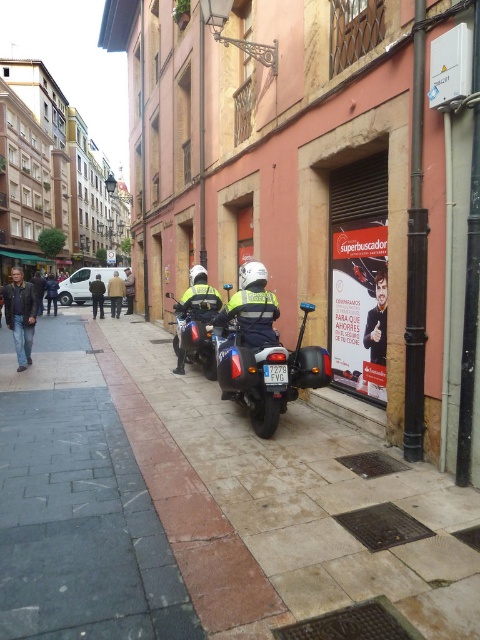
Question: Based on their relative distances, which object is farther from the shiny black motorcycle at center?

Choices:
 (A) metallic silver motorcycle at center
 (B) paved stone sidewalk at center
 (C) smooth black suit at center

Answer: (C)

Question: Which point appears closest to the camera in this image?

Choices:
 (A) tap(229, 301)
 (B) tap(375, 285)
 (C) tap(173, 342)
 (D) tap(124, 285)

Answer: (B)

Question: Does metallic silver motorcycle at center lie behind smooth black suit at center?

Choices:
 (A) no
 (B) yes

Answer: (A)

Question: Is paved stone sidewalk at center positioned at the back of leather jacket at left?

Choices:
 (A) yes
 (B) no

Answer: (B)

Question: Which of the following is the farthest from the observer?

Choices:
 (A) dark brown leather jacket at center
 (B) paved stone sidewalk at center
 (C) shiny black motorcycle at center
 (D) light brown leather jacket at center

Answer: (D)

Question: Does matte paper poster at center appear over dark blue jacket at center?

Choices:
 (A) no
 (B) yes

Answer: (A)